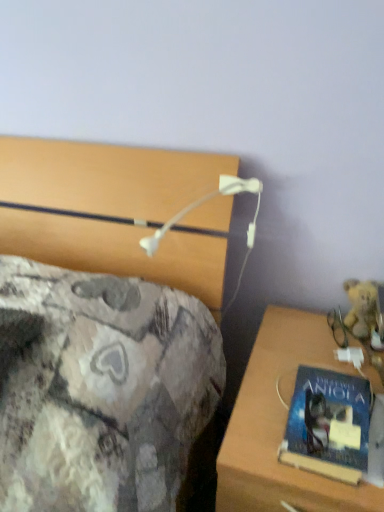
Question: From the image's perspective, is wooden desk at lower right beneath blue matte book at right?

Choices:
 (A) no
 (B) yes

Answer: (B)

Question: Is wooden desk at lower right to the right of blue matte book at right from the viewer's perspective?

Choices:
 (A) yes
 (B) no

Answer: (A)

Question: Is the position of wooden desk at lower right less distant than that of blue matte book at right?

Choices:
 (A) yes
 (B) no

Answer: (A)

Question: Is wooden desk at lower right positioned with its back to blue matte book at right?

Choices:
 (A) no
 (B) yes

Answer: (A)

Question: Considering the relative sizes of wooden desk at lower right and blue matte book at right in the image provided, is wooden desk at lower right taller than blue matte book at right?

Choices:
 (A) no
 (B) yes

Answer: (B)

Question: Is wooden desk at lower right outside blue matte book at right?

Choices:
 (A) no
 (B) yes

Answer: (B)

Question: Does fuzzy yellow teddy bear at right have a smaller size compared to wooden desk at lower right?

Choices:
 (A) no
 (B) yes

Answer: (B)

Question: Is fuzzy yellow teddy bear at right facing away from wooden desk at lower right?

Choices:
 (A) no
 (B) yes

Answer: (A)

Question: From a real-world perspective, is fuzzy yellow teddy bear at right positioned under wooden desk at lower right based on gravity?

Choices:
 (A) no
 (B) yes

Answer: (A)

Question: Is fuzzy yellow teddy bear at right bigger than wooden desk at lower right?

Choices:
 (A) no
 (B) yes

Answer: (A)

Question: Does fuzzy yellow teddy bear at right appear on the right side of wooden desk at lower right?

Choices:
 (A) no
 (B) yes

Answer: (B)

Question: Does fuzzy yellow teddy bear at right have a greater height compared to wooden desk at lower right?

Choices:
 (A) yes
 (B) no

Answer: (B)

Question: Can you confirm if blue matte book at right is smaller than wooden desk at lower right?

Choices:
 (A) no
 (B) yes

Answer: (B)